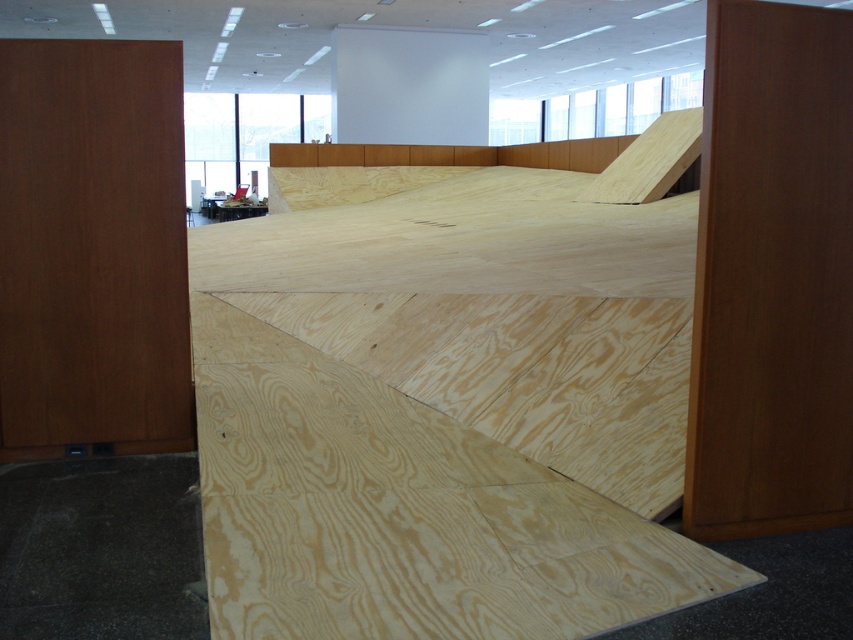
Question: Which object appears farthest from the camera in this image?

Choices:
 (A) natural wood ramp at center
 (B) brown wood/plywood at left

Answer: (B)

Question: Is natural wood ramp at center behind brown wood/plywood at left?

Choices:
 (A) yes
 (B) no

Answer: (B)

Question: Which point is closer to the camera?

Choices:
 (A) natural wood ramp at center
 (B) brown wood/plywood at left

Answer: (A)

Question: Can you confirm if natural wood ramp at center is positioned above brown wood/plywood at left?

Choices:
 (A) no
 (B) yes

Answer: (B)

Question: Is natural wood ramp at center positioned in front of brown wood/plywood at left?

Choices:
 (A) no
 (B) yes

Answer: (B)